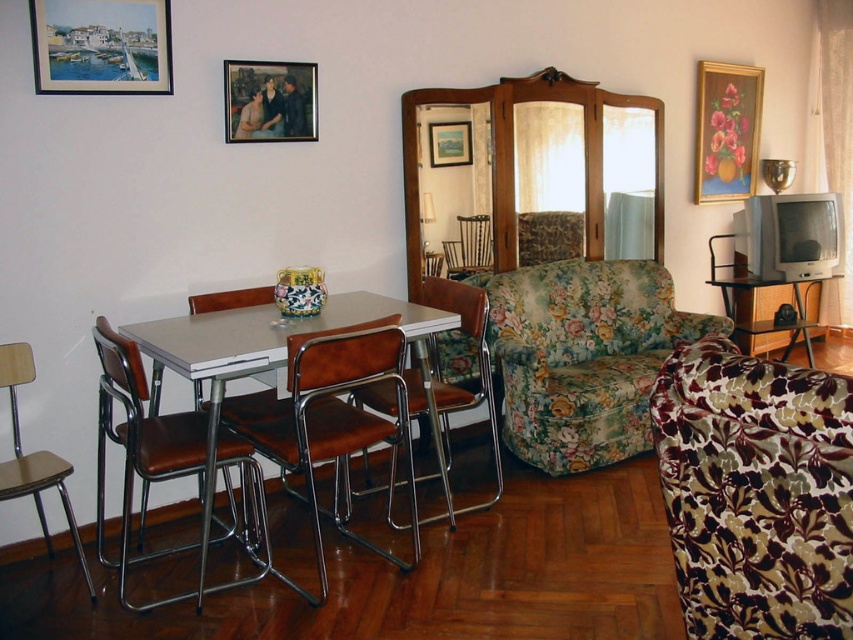
Measure the distance between floral fabric couch at center and brown leather chair at left.

They are 1.68 meters apart.

Does point (555, 266) come closer to viewer compared to point (177, 596)?

No, it is behind (177, 596).

You are a GUI agent. You are given a task and a screenshot of the screen. Output one action in this format:
    pyautogui.click(x=<x>, y=<y>)
    Task: Click on the floral fabric couch at center
    Image resolution: width=853 pixels, height=640 pixels.
    Given the screenshot: What is the action you would take?
    pyautogui.click(x=583, y=356)

Who is more distant from viewer, (572, 260) or (268, 92)?

Positioned behind is point (572, 260).

Can you confirm if floral fabric couch at center is positioned to the right of wooden picture frame at upper center?

Correct, you'll find floral fabric couch at center to the right of wooden picture frame at upper center.

Is point (641, 317) less distant than point (289, 67)?

That is False.

Find the location of a particular element. This screenshot has height=640, width=853. floral fabric couch at center is located at coordinates (583, 356).

Consider the image. Is metallic gray table at center thinner than wooden picture frame at upper center?

In fact, metallic gray table at center might be wider than wooden picture frame at upper center.

What do you see at coordinates (260, 356) in the screenshot?
I see `metallic gray table at center` at bounding box center [260, 356].

Find the location of `metallic gray table at center`. metallic gray table at center is located at coordinates (260, 356).